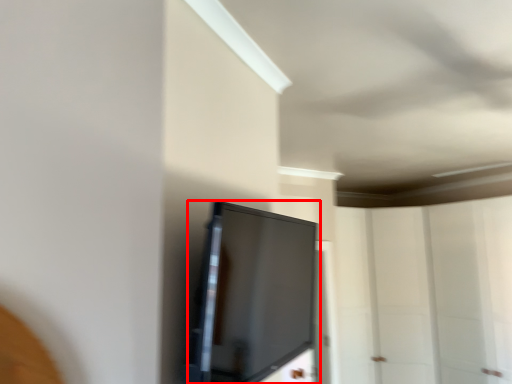
Question: From the image's perspective, considering the relative positions of screen (annotated by the red box) and glass door in the image provided, where is screen (annotated by the red box) located with respect to the staircase?

Choices:
 (A) below
 (B) above

Answer: (B)